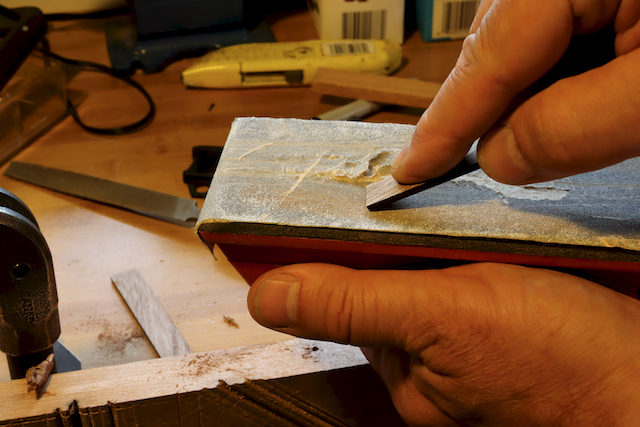
Locate an element on the screen. This screenshot has height=427, width=640. cord is located at coordinates (116, 127).